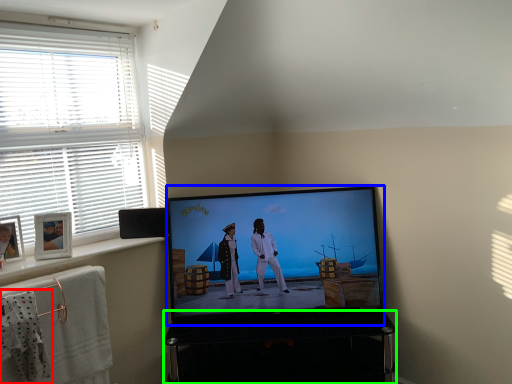
Question: Which object is positioned farthest from laundry (highlighted by a red box)? Select from television (highlighted by a blue box) and furniture (highlighted by a green box).

Choices:
 (A) television
 (B) furniture

Answer: (A)